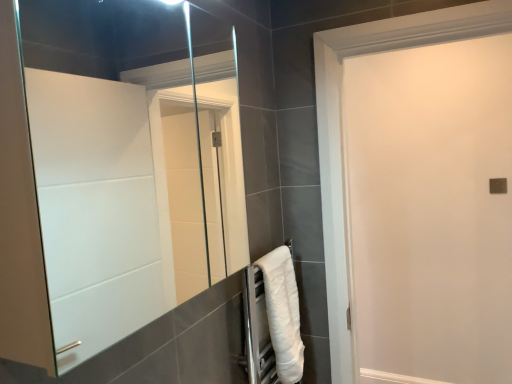
Question: Can you confirm if white fluffy towel at lower right is shorter than white matte door at center?

Choices:
 (A) yes
 (B) no

Answer: (A)

Question: From the image's perspective, is white fluffy towel at lower right over white matte door at center?

Choices:
 (A) yes
 (B) no

Answer: (B)

Question: Is white fluffy towel at lower right not near white matte door at center?

Choices:
 (A) yes
 (B) no

Answer: (A)

Question: From a real-world perspective, is white fluffy towel at lower right physically below white matte door at center?

Choices:
 (A) yes
 (B) no

Answer: (A)

Question: Is white fluffy towel at lower right not within white matte door at center?

Choices:
 (A) no
 (B) yes

Answer: (B)

Question: From the image's perspective, is white matte door at center located above or below white fluffy towel at lower right?

Choices:
 (A) below
 (B) above

Answer: (B)

Question: Considering their positions, is white matte door at center located in front of or behind white fluffy towel at lower right?

Choices:
 (A) front
 (B) behind

Answer: (A)

Question: Which is correct: white matte door at center is inside white fluffy towel at lower right, or outside of it?

Choices:
 (A) inside
 (B) outside

Answer: (B)

Question: Considering the positions of point pyautogui.click(x=481, y=359) and point pyautogui.click(x=289, y=380), is point pyautogui.click(x=481, y=359) closer or farther from the camera than point pyautogui.click(x=289, y=380)?

Choices:
 (A) closer
 (B) farther

Answer: (B)

Question: From a real-world perspective, is clear glass mirror at center physically located above or below white fluffy towel at lower right?

Choices:
 (A) below
 (B) above

Answer: (B)

Question: Considering the relative positions of clear glass mirror at center and white fluffy towel at lower right in the image provided, is clear glass mirror at center to the left or to the right of white fluffy towel at lower right?

Choices:
 (A) right
 (B) left

Answer: (B)

Question: Is point (56, 301) closer or farther from the camera than point (270, 284)?

Choices:
 (A) closer
 (B) farther

Answer: (B)

Question: Is clear glass mirror at center spatially inside white fluffy towel at lower right, or outside of it?

Choices:
 (A) outside
 (B) inside

Answer: (A)

Question: In terms of height, does white fluffy towel at lower right look taller or shorter compared to clear glass mirror at center?

Choices:
 (A) short
 (B) tall

Answer: (A)

Question: Does point (265, 294) appear closer or farther from the camera than point (233, 269)?

Choices:
 (A) farther
 (B) closer

Answer: (B)